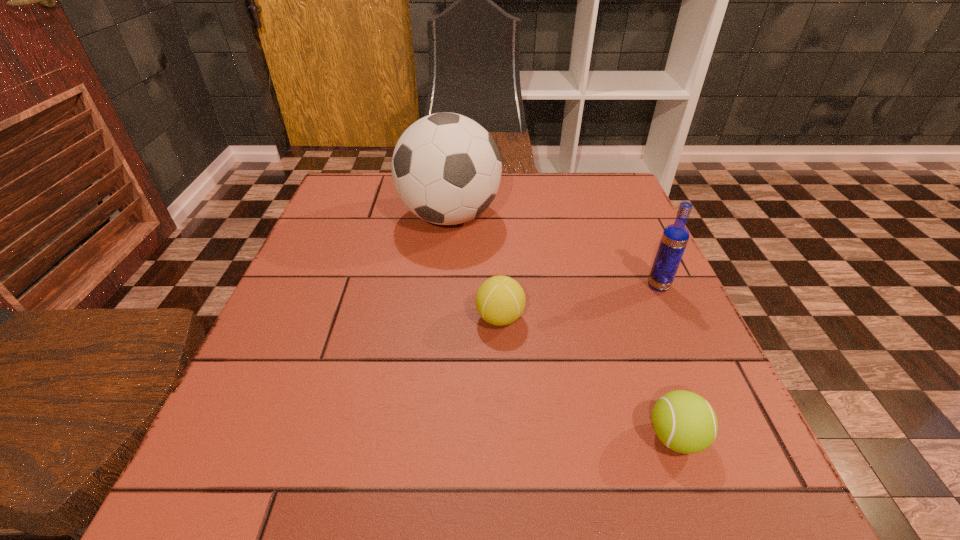
This screenshot has height=540, width=960. In order to click on vacant space at the right edge of the desktop in this screenshot , I will do `click(655, 245)`.

This screenshot has height=540, width=960. I want to click on free space at the far left corner of the desktop, so click(378, 192).

The height and width of the screenshot is (540, 960). In the image, there is a desktop. In order to click on vacant space at the near left corner in this screenshot , I will do coord(235,491).

This screenshot has width=960, height=540. I want to click on free spot at the far right corner of the desktop, so click(x=588, y=196).

I want to click on free spot between the nearer tennis ball and the vodka, so click(x=667, y=361).

The width and height of the screenshot is (960, 540). What are the coordinates of `blank region between the tallest object and the left tennis ball` in the screenshot? It's located at (474, 267).

Find the location of `vacant region between the rightmost object and the second nearest object`. vacant region between the rightmost object and the second nearest object is located at coordinates (579, 302).

Find the location of a particular element. The image size is (960, 540). blank region between the soccer ball and the farther tennis ball is located at coordinates (474, 267).

This screenshot has width=960, height=540. I want to click on vacant region between the second nearest object and the second object from right to left, so click(x=588, y=377).

Where is `vacant space that is in between the farther tennis ball and the third object from left to right`? vacant space that is in between the farther tennis ball and the third object from left to right is located at coordinates (588, 377).